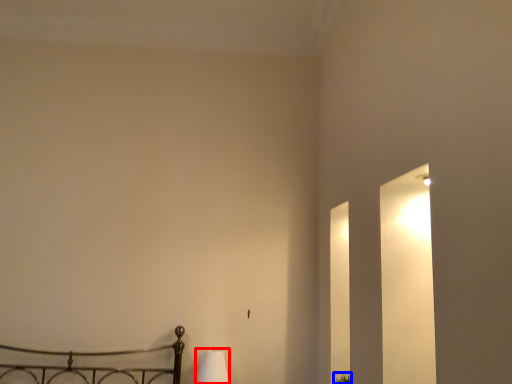
Question: Among these objects, which one is farthest to the camera, lamp (highlighted by a red box) or plant (highlighted by a blue box)?

Choices:
 (A) lamp
 (B) plant

Answer: (A)